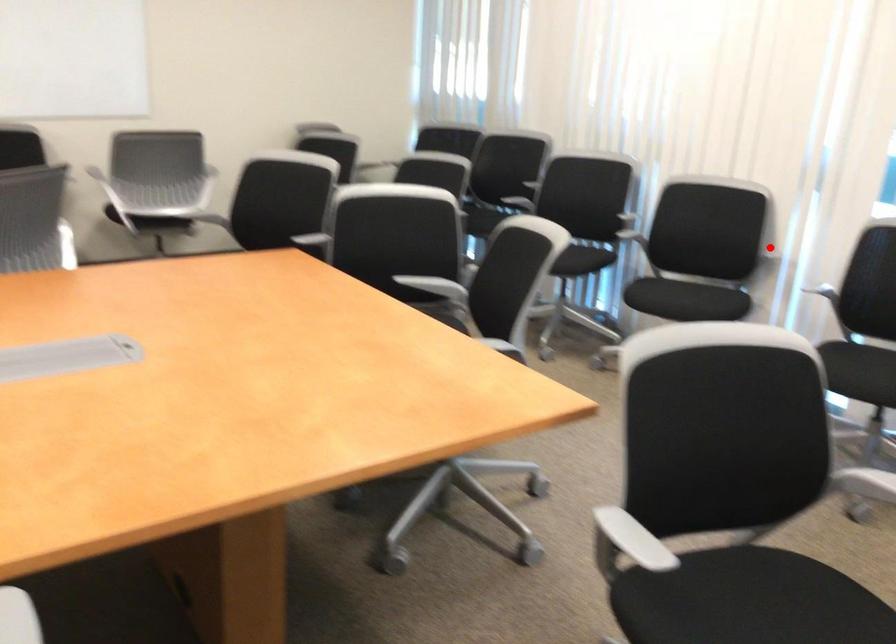
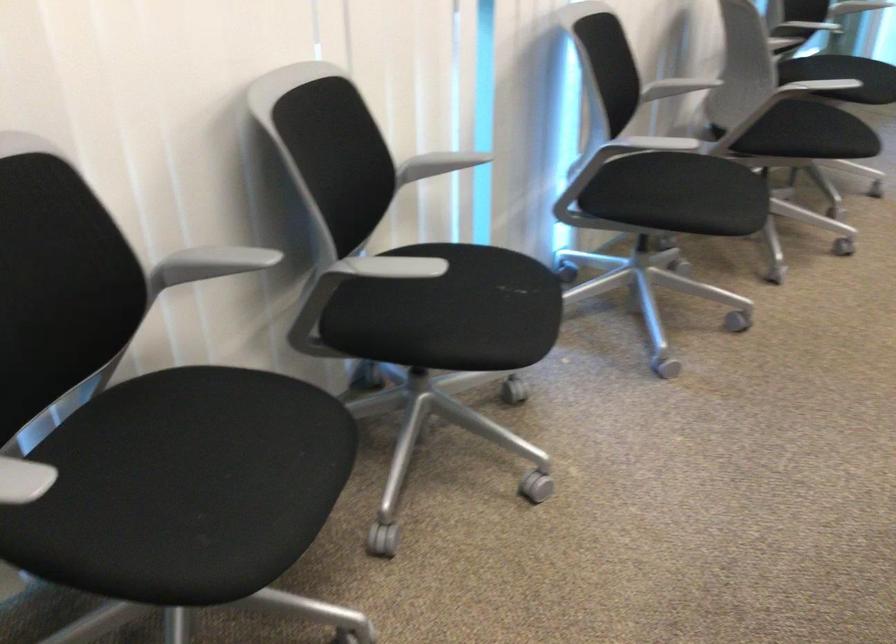
Question: I am providing you with two images of the same scene from different viewpoints. A red point is shown in image1. For the corresponding object point in image2, is it positioned nearer or farther from the camera?

Choices:
 (A) Nearer
 (B) Farther

Answer: (A)